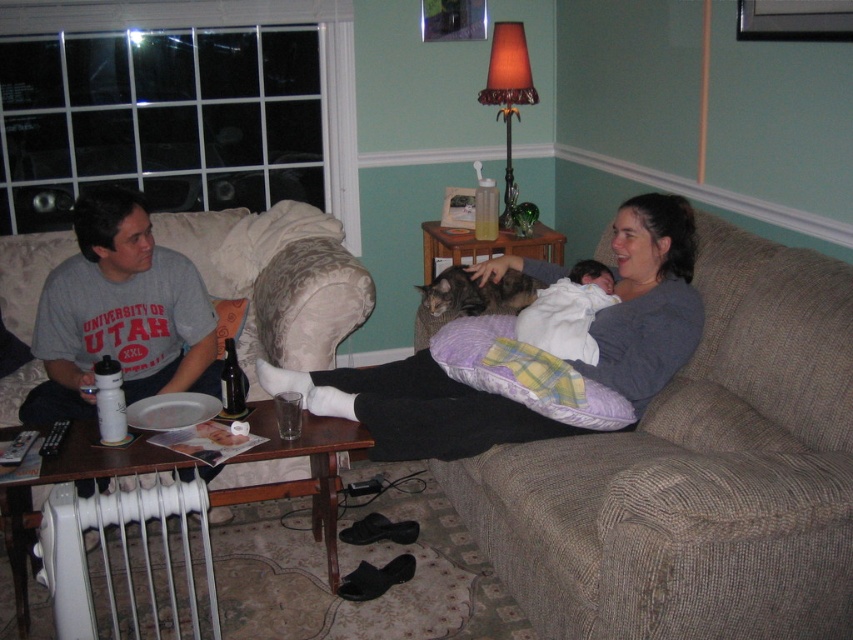
Between point (61, 316) and point (479, 305), which one is positioned behind?

The point (479, 305) is more distant.

Is gray cotton t-shirt at left taller than gray fur cat at center?

Yes.

Image resolution: width=853 pixels, height=640 pixels. I want to click on gray cotton t-shirt at left, so click(x=119, y=314).

Locate an element on the screen. This screenshot has width=853, height=640. gray cotton t-shirt at left is located at coordinates (119, 314).

Is gray soft fabric woman at center smaller than gray fur cat at center?

No.

Is point (663, 362) positioned in front of point (445, 310)?

Yes, it is in front of point (445, 310).

Where is `gray soft fabric woman at center`? The width and height of the screenshot is (853, 640). gray soft fabric woman at center is located at coordinates (415, 408).

Between point (576, 358) and point (228, 371), which one is positioned in front?

Point (228, 371) is in front.

Identify the location of white soft baby at center. The image size is (853, 640). (567, 312).